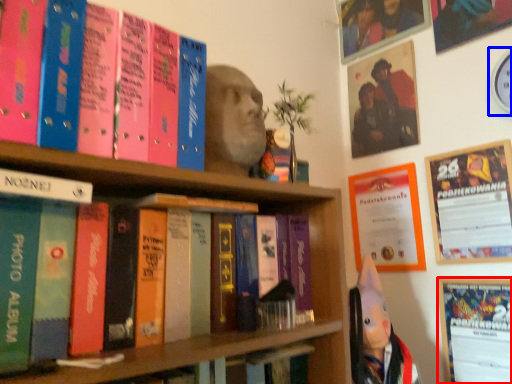
Question: Which object appears closest to the camera in this image, bulletin board (highlighted by a red box) or clock (highlighted by a blue box)?

Choices:
 (A) bulletin board
 (B) clock

Answer: (B)